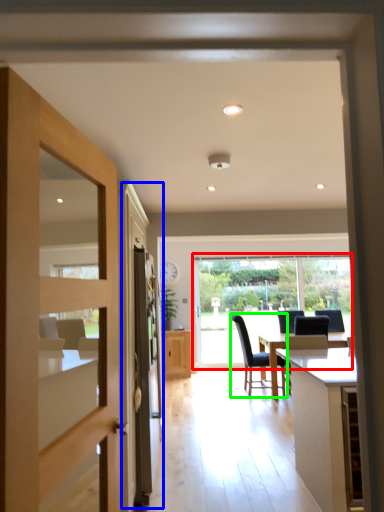
Question: Which object is the farthest from window (highlighted by a red box)? Choose among these: screen door (highlighted by a blue box) or chair (highlighted by a green box).

Choices:
 (A) screen door
 (B) chair

Answer: (A)